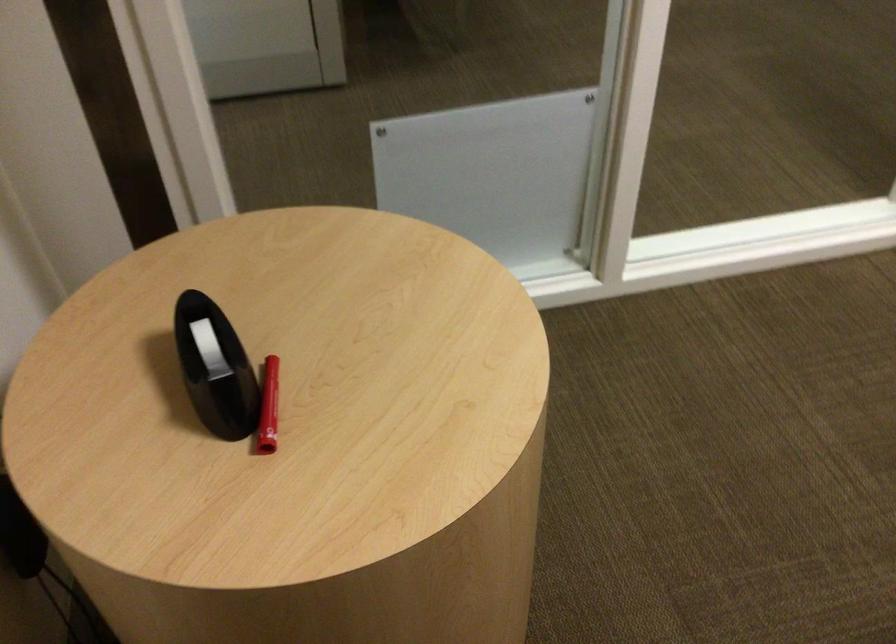
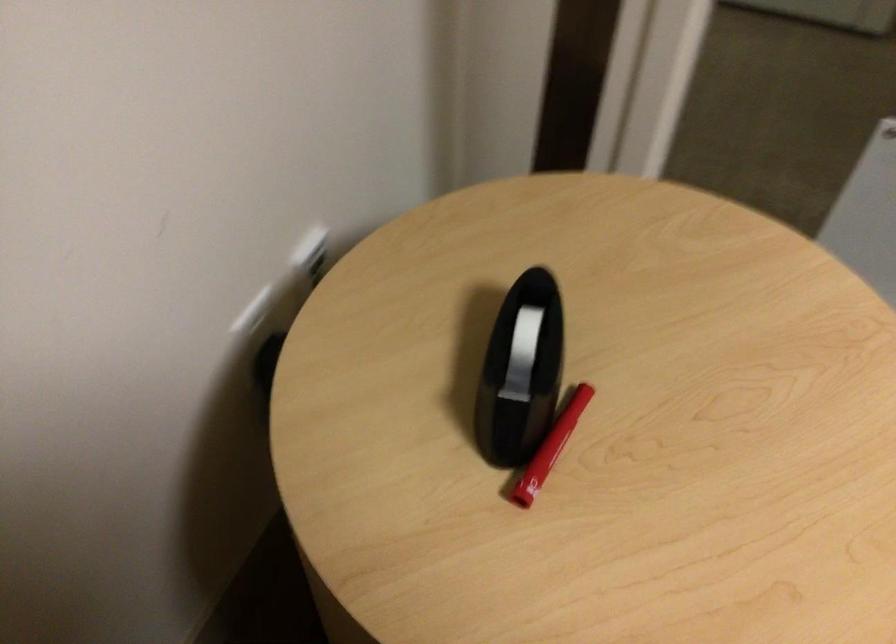
Find the pixel in the second image that matches [218,368] in the first image.

(521, 371)